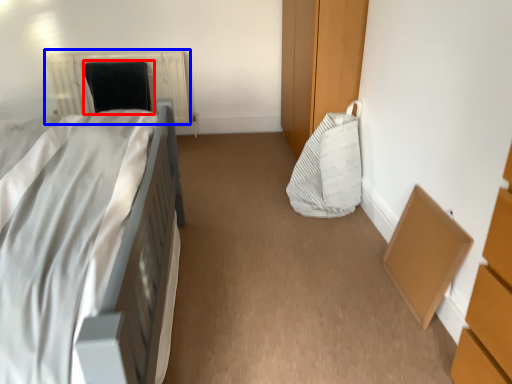
Question: Which object appears farthest to the camera in this image, bean bag chair (highlighted by a red box) or radiator (highlighted by a blue box)?

Choices:
 (A) bean bag chair
 (B) radiator

Answer: (B)